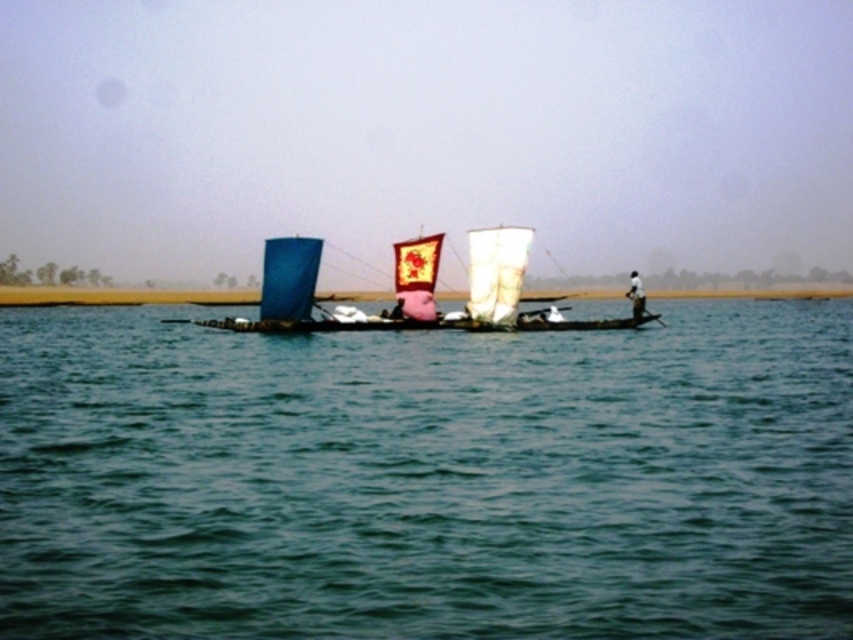
Question: Considering the real-world distances, which object is closest to the white fabric boat at right?

Choices:
 (A) green water at center
 (B) blue fabric sailboat at center

Answer: (B)

Question: Does green water at center appear under white fabric boat at right?

Choices:
 (A) no
 (B) yes

Answer: (B)

Question: Is green water at center closer to the viewer compared to white fabric boat at right?

Choices:
 (A) no
 (B) yes

Answer: (B)

Question: Can you confirm if green water at center is positioned to the right of white fabric boat at right?

Choices:
 (A) yes
 (B) no

Answer: (B)

Question: Which of these objects is positioned closest to the blue fabric sailboat at center?

Choices:
 (A) white fabric boat at right
 (B) green water at center

Answer: (B)

Question: Which point is closer to the camera?

Choices:
 (A) (640, 298)
 (B) (526, 234)

Answer: (B)